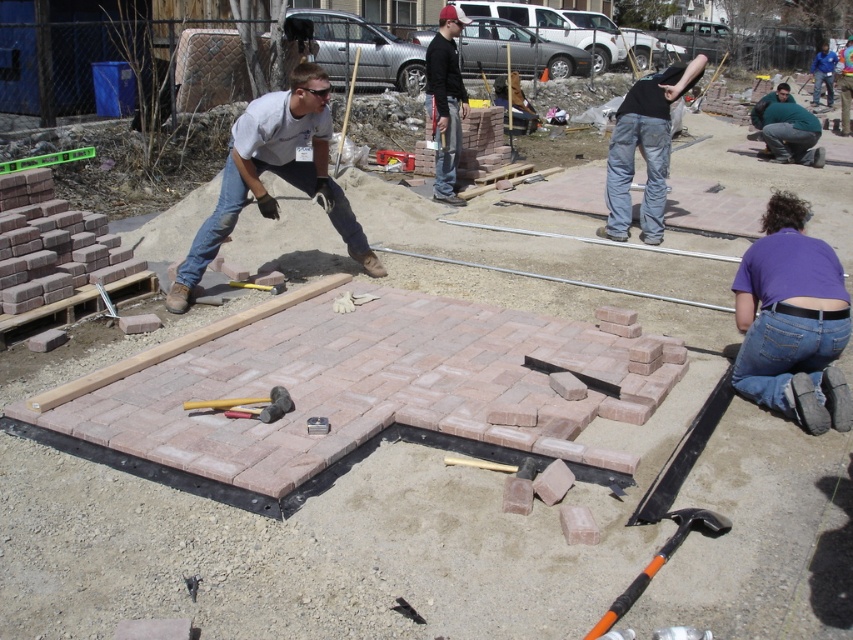
Question: Which point is farther to the camera?

Choices:
 (A) (828, 282)
 (B) (456, 99)
 (C) (317, 186)

Answer: (B)

Question: Which object appears closest to the camera in this image?

Choices:
 (A) matte black shirt at upper center
 (B) matte gray shirt at center

Answer: (B)

Question: Can you confirm if purple cotton shirt at lower right is bigger than yellow rubber mallet at center?

Choices:
 (A) no
 (B) yes

Answer: (B)

Question: Based on their relative distances, which object is farther from the fat man at lower right?

Choices:
 (A) yellow rubber mallet at center
 (B) purple cotton shirt at lower right
 (C) matte gray shirt at center

Answer: (A)

Question: Does matte black shirt at upper center appear on the left side of yellow rubber mallet at center?

Choices:
 (A) no
 (B) yes

Answer: (A)

Question: Can you confirm if fat man at lower right is wider than yellow rubber mallet at center?

Choices:
 (A) yes
 (B) no

Answer: (A)